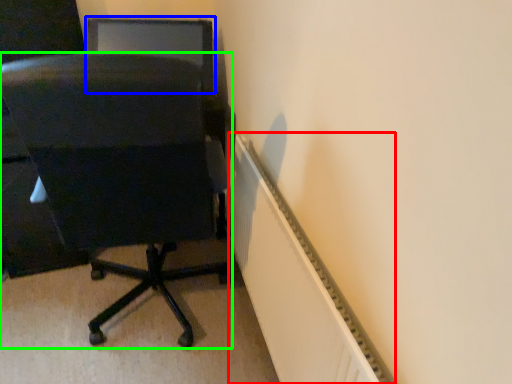
Question: Considering the real-world distances, which object is closest to radiator (highlighted by a red box)? computer monitor (highlighted by a blue box) or chair (highlighted by a green box).

Choices:
 (A) computer monitor
 (B) chair

Answer: (B)